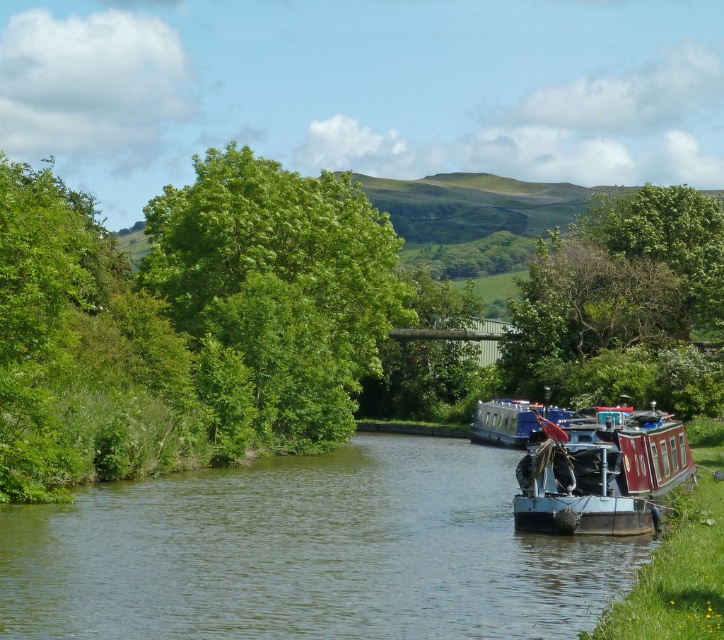
Question: Estimate the real-world distances between objects in this image. Which object is farther from the blue polished wood boat at center?

Choices:
 (A) green smooth water at center
 (B) green leafy tree at center
 (C) red wooden boat at center
 (D) green leafy tree at upper center

Answer: (B)

Question: Observing the image, what is the correct spatial positioning of green smooth water at center in reference to blue polished wood boat at center?

Choices:
 (A) above
 (B) below

Answer: (B)

Question: Can you confirm if green leafy tree at center is positioned to the right of green leafy tree at upper center?

Choices:
 (A) yes
 (B) no

Answer: (B)

Question: Does green smooth water at center have a lesser width compared to blue polished wood boat at center?

Choices:
 (A) yes
 (B) no

Answer: (B)

Question: Which object is positioned farthest from the green leafy tree at center?

Choices:
 (A) green smooth water at center
 (B) red wooden boat at center
 (C) blue polished wood boat at center
 (D) green leafy tree at upper center

Answer: (D)

Question: Based on their relative distances, which object is farther from the blue polished wood boat at center?

Choices:
 (A) red wooden boat at center
 (B) green smooth water at center
 (C) green leafy tree at upper center

Answer: (C)